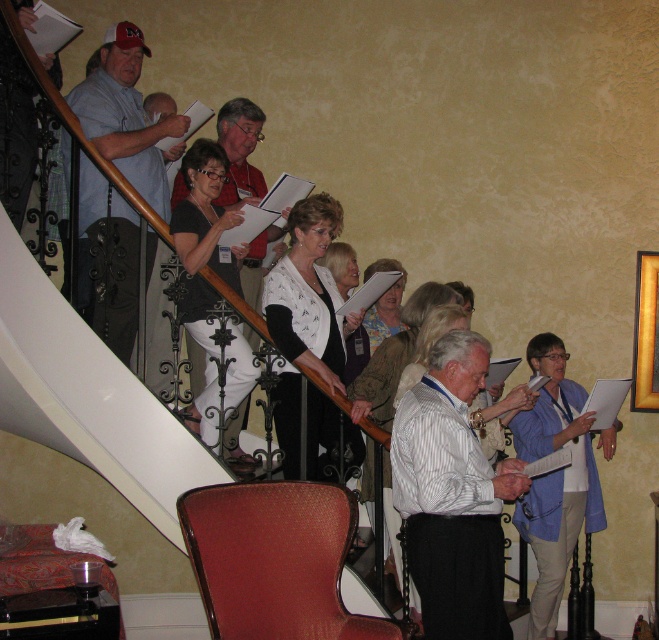
You are standing at the bottom of the staircase and want to move towards the nearest point between point (335, 248) and point (370, 326). Which point should you head towards?

Point (335, 248) is closer to the viewer than point (370, 326), so you should head towards point (335, 248).

You are an actor standing on the staircase and need to hand a prop to another actor. You see the red textured fabric chair at lower center and the white textured vest at center. Which object is closer to you?

The red textured fabric chair at lower center is closer to you because it is in front of the white textured vest at center.

You are organizing a small event and need to place a 1.2 meter wide table between the red textured fabric chair at lower center and the white textured vest at center. Can the table fit in the space between them?

The red textured fabric chair at lower center might be wider than the white textured vest at center, so the space between them may not be sufficient to fit a 1.2 meter wide table. You should measure the actual distance before placing the table.